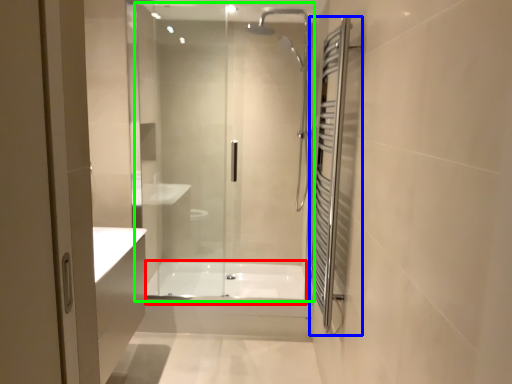
Question: Which object is positioned farthest from bath (highlighted by a red box)? Select from screen door (highlighted by a blue box) and shower door (highlighted by a green box).

Choices:
 (A) screen door
 (B) shower door

Answer: (A)